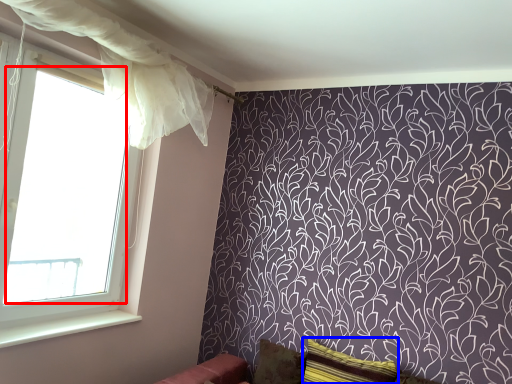
Question: Which object is further to the camera taking this photo, window screen (highlighted by a red box) or pillow (highlighted by a blue box)?

Choices:
 (A) window screen
 (B) pillow

Answer: (B)